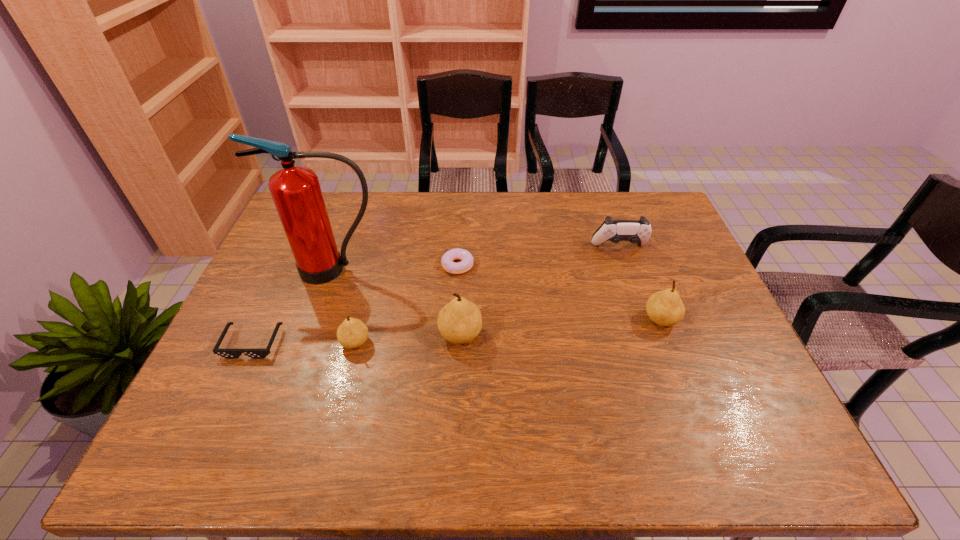
Identify the location of free location located on the back of the tallest pear. This screenshot has width=960, height=540. (464, 249).

The width and height of the screenshot is (960, 540). Identify the location of free space located 0.070m on the back of the second tallest pear. (649, 288).

Where is `vacant space located on the front of the tallest object`? vacant space located on the front of the tallest object is located at coordinates (315, 323).

Locate an element on the screen. Image resolution: width=960 pixels, height=540 pixels. blank space located 0.300m on the front of the doughnut is located at coordinates (452, 359).

You are a GUI agent. You are given a task and a screenshot of the screen. Output one action in this format:
    pyautogui.click(x=<x>, y=<y>)
    Task: Click on the vacant space situated on the front-facing side of the control
    The image size is (960, 540).
    Given the screenshot: What is the action you would take?
    pyautogui.click(x=631, y=282)

Locate an element on the screen. The width and height of the screenshot is (960, 540). free space located on the front-facing side of the sunglasses is located at coordinates (235, 379).

Locate an element on the screen. fire extinguisher that is at the left edge is located at coordinates (296, 191).

The image size is (960, 540). In order to click on sunglasses located at the left edge in this screenshot , I will do `click(227, 353)`.

I want to click on pear that is at the right edge, so click(x=665, y=308).

Locate an element on the screen. control that is at the right edge is located at coordinates (639, 232).